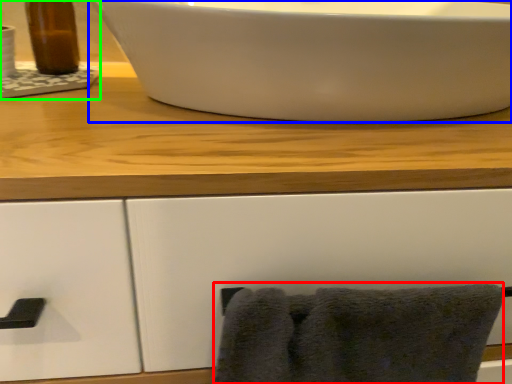
Question: Which object is positioned farthest from bath towel (highlighted by a red box)? Select from sink (highlighted by a blue box) and sink (highlighted by a green box).

Choices:
 (A) sink
 (B) sink

Answer: (B)